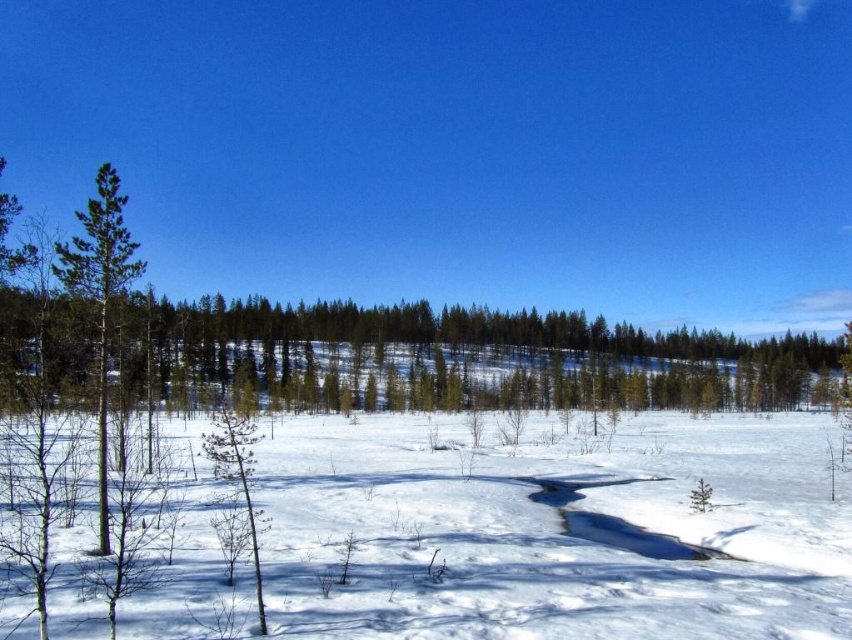
Question: Is green matte tree at left to the right of green matte tree at lower left from the viewer's perspective?

Choices:
 (A) yes
 (B) no

Answer: (A)

Question: Does white powdery snow at center have a smaller size compared to green matte tree at left?

Choices:
 (A) yes
 (B) no

Answer: (B)

Question: Which point is farther to the camera?

Choices:
 (A) green matte tree at lower left
 (B) white powdery snow at center
 (C) green matte tree at left

Answer: (C)

Question: Can you confirm if white powdery snow at center is positioned to the right of green matte tree at lower left?

Choices:
 (A) no
 (B) yes

Answer: (B)

Question: Considering the real-world distances, which object is closest to the white powdery snow at center?

Choices:
 (A) green matte tree at left
 (B) green matte tree at lower left

Answer: (B)

Question: Which is farther from the white powdery snow at center?

Choices:
 (A) green matte tree at lower left
 (B) green matte tree at left

Answer: (B)